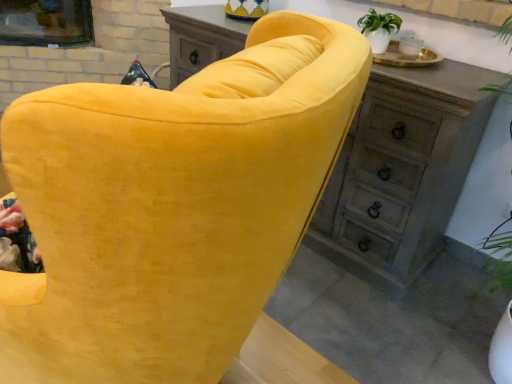
Question: Is wooden chest of drawers at upper center facing away from velvet yellow sofa at center?

Choices:
 (A) no
 (B) yes

Answer: (A)

Question: From the image's perspective, is wooden chest of drawers at upper center above velvet yellow sofa at center?

Choices:
 (A) no
 (B) yes

Answer: (B)

Question: Are wooden chest of drawers at upper center and velvet yellow sofa at center making contact?

Choices:
 (A) yes
 (B) no

Answer: (B)

Question: From the image's perspective, is wooden chest of drawers at upper center under velvet yellow sofa at center?

Choices:
 (A) no
 (B) yes

Answer: (A)

Question: Is wooden chest of drawers at upper center wider than velvet yellow sofa at center?

Choices:
 (A) yes
 (B) no

Answer: (B)

Question: Does wooden chest of drawers at upper center appear on the right side of velvet yellow sofa at center?

Choices:
 (A) yes
 (B) no

Answer: (A)

Question: Can you confirm if wooden dresser at center is taller than wooden chest of drawers at upper center?

Choices:
 (A) no
 (B) yes

Answer: (B)

Question: Is wooden dresser at center closer to camera compared to wooden chest of drawers at upper center?

Choices:
 (A) yes
 (B) no

Answer: (A)

Question: Can you confirm if wooden dresser at center is wider than wooden chest of drawers at upper center?

Choices:
 (A) yes
 (B) no

Answer: (A)

Question: Is wooden dresser at center facing towards wooden chest of drawers at upper center?

Choices:
 (A) no
 (B) yes

Answer: (A)

Question: Considering the relative sizes of wooden dresser at center and wooden chest of drawers at upper center in the image provided, is wooden dresser at center thinner than wooden chest of drawers at upper center?

Choices:
 (A) no
 (B) yes

Answer: (A)

Question: Can you confirm if wooden dresser at center is bigger than wooden chest of drawers at upper center?

Choices:
 (A) yes
 (B) no

Answer: (B)

Question: Can wooden dresser at center be found inside wooden chest of drawers at upper center?

Choices:
 (A) yes
 (B) no

Answer: (B)